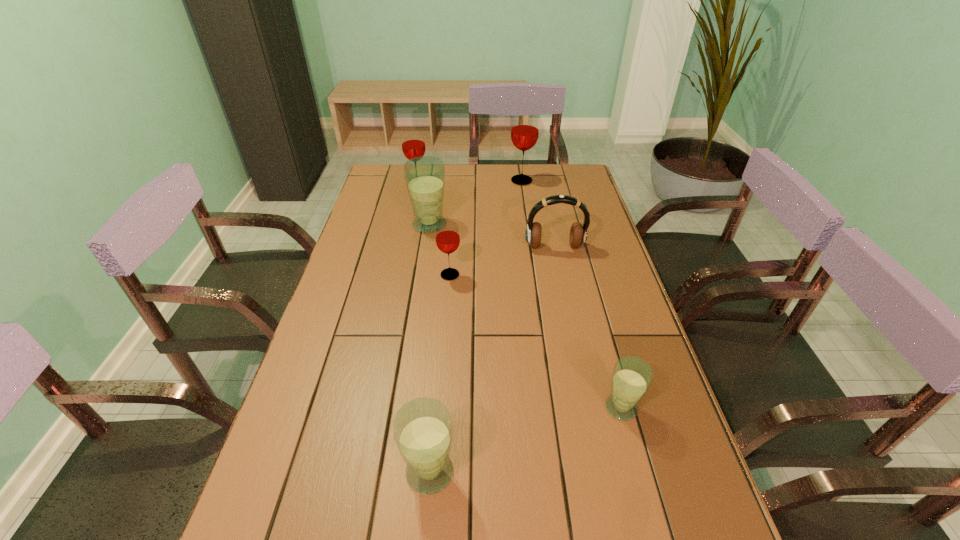
Locate an element on the screen. The image size is (960, 540). the biggest red glass is located at coordinates (524, 134).

This screenshot has width=960, height=540. Find the location of `the tallest glass`. the tallest glass is located at coordinates (524, 134).

The width and height of the screenshot is (960, 540). I want to click on the second biggest red glass, so click(413, 143).

Locate an element on the screen. the farthest blue glass is located at coordinates (425, 176).

Image resolution: width=960 pixels, height=540 pixels. I want to click on the biggest blue glass, so click(x=425, y=176).

Identify the location of brown headset. This screenshot has height=540, width=960. (578, 233).

Locate an element on the screen. the fourth farthest object is located at coordinates (578, 233).

Identify the location of the second red glass from right to left. The height and width of the screenshot is (540, 960). (447, 237).

The height and width of the screenshot is (540, 960). Find the location of `the nearest red glass`. the nearest red glass is located at coordinates (447, 237).

Find the location of `the nearest object`. the nearest object is located at coordinates (422, 428).